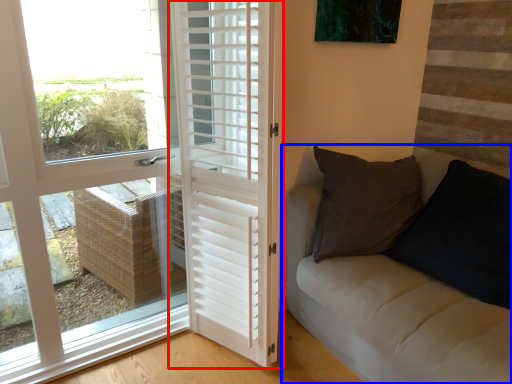
Question: Among these objects, which one is nearest to the camera, door (highlighted by a red box) or studio couch (highlighted by a blue box)?

Choices:
 (A) door
 (B) studio couch

Answer: (B)